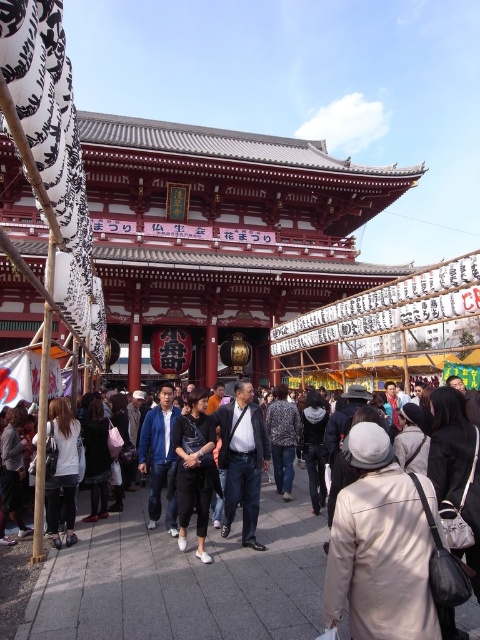
Question: Estimate the real-world distances between objects in this image. Which object is closer to the dark blue jeans at center?

Choices:
 (A) dark gray wool coat at center
 (B) patterned fabric coat at center
 (C) beige fabric coat at center

Answer: (A)

Question: Can you confirm if denim jacket at lower left is bigger than dark gray fabric backpack at center?

Choices:
 (A) yes
 (B) no

Answer: (B)

Question: Which point is farther from the camera taking this photo?

Choices:
 (A) (107, 428)
 (B) (176, 448)

Answer: (A)

Question: Which point is farther to the camera?

Choices:
 (A) (51, 433)
 (B) (308, 472)
 (C) (26, 412)
 (D) (87, 428)

Answer: (B)

Question: Does white matte jacket at center have a greater width compared to dark gray wool coat at center?

Choices:
 (A) yes
 (B) no

Answer: (A)

Question: Does denim jacket at lower left appear under patterned fabric coat at center?

Choices:
 (A) no
 (B) yes

Answer: (A)